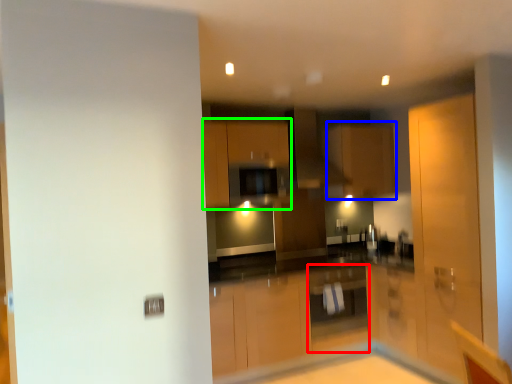
Question: Which object is positioned farthest from cabinetry (highlighted by a red box)? Select from cabinetry (highlighted by a blue box) and cabinetry (highlighted by a green box).

Choices:
 (A) cabinetry
 (B) cabinetry

Answer: (B)